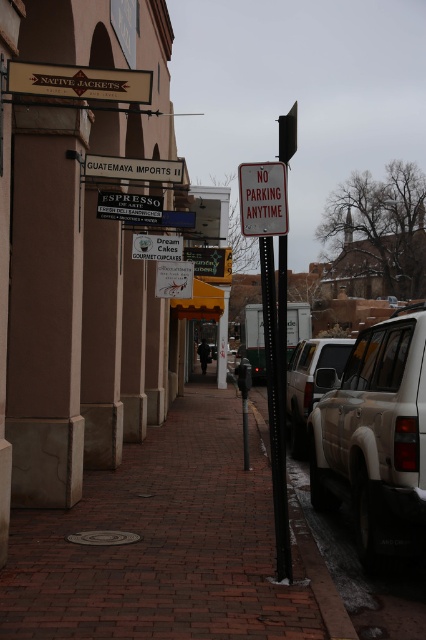
You are a delivery person trying to park your 1.2 meter wide cart between the brick pavement at center and the metallic sign at center. Can your cart fit in the space between them?

The brick pavement at center is wider than the metallic sign at center. Since the cart is 1.2 meters wide, it depends on the exact width of the space between them. However, the description only states that the brick pavement is wider, but doesn not provide numerical measurements. Without specific measurements, it is impossible to determine if the cart will fit.

Looking at this image, you are a delivery person needing to park your vehicle, which is the same size as the tan matte suv at right. There is a parking spot next to the white plastic sign at center. Will your vehicle fit in that spot?

The tan matte suv at right occupies less space than the white plastic sign at center, so yes, your vehicle will fit in the parking spot next to the white plastic sign at center because the suv is smaller in size.

You are a delivery person trying to place a large box on the ground in the scene. The box is 1.2 meters tall. You see the brick pavement at center and the black metal pole at lower center. Which surface can safely accommodate the box without it hitting the pole?

The brick pavement at center has a lesser height compared to the black metal pole at lower center, so placing the box on the brick pavement at center would be safer as it is lower and less likely to hit the pole.